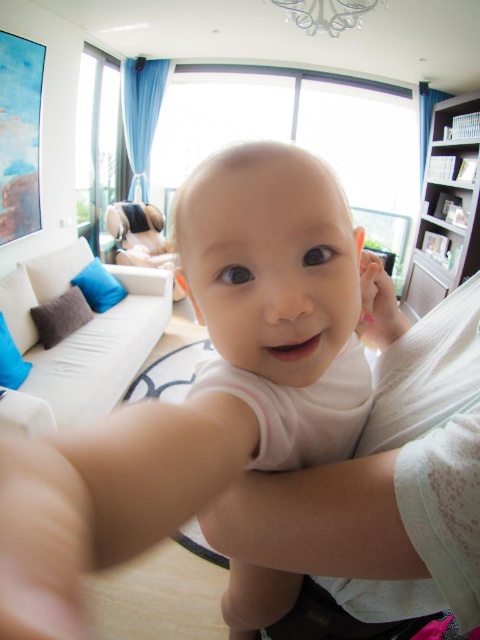
Question: Among these points, which one is nearest to the camera?

Choices:
 (A) (360, 317)
 (B) (59, 579)

Answer: (B)

Question: In this image, where is white soft baby at center located relative to pink matte hand at center?

Choices:
 (A) below
 (B) above

Answer: (A)

Question: Can you confirm if white soft baby at center is thinner than pink matte hand at center?

Choices:
 (A) no
 (B) yes

Answer: (A)

Question: Considering the relative positions of white soft baby at center and pink matte hand at center in the image provided, where is white soft baby at center located with respect to pink matte hand at center?

Choices:
 (A) below
 (B) above

Answer: (A)

Question: Which point is closer to the camera?

Choices:
 (A) (17, 506)
 (B) (391, 307)

Answer: (A)

Question: Among these points, which one is farthest from the camera?

Choices:
 (A) (236, 627)
 (B) (360, 282)

Answer: (A)